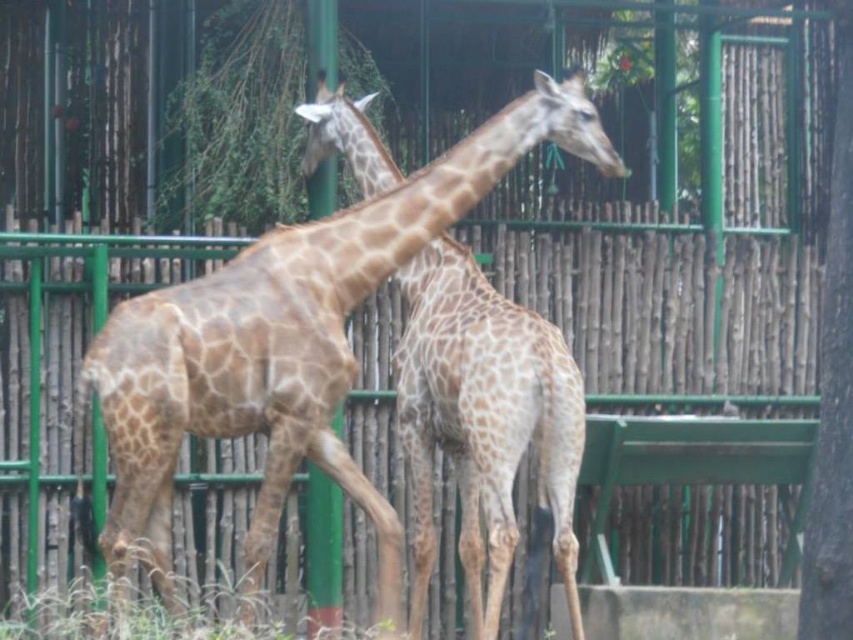
Question: Can you confirm if green bamboo fence at center is thinner than spotted fur giraffe at center?

Choices:
 (A) yes
 (B) no

Answer: (B)

Question: Considering the relative positions of green bamboo fence at center and spotted fur giraffe at center in the image provided, where is green bamboo fence at center located with respect to spotted fur giraffe at center?

Choices:
 (A) below
 (B) above

Answer: (B)

Question: Among these objects, which one is farthest from the camera?

Choices:
 (A) spotted fur giraffe at center
 (B) green bamboo fence at center

Answer: (B)

Question: Is green bamboo fence at center to the right of spotted fur giraffe at center from the viewer's perspective?

Choices:
 (A) no
 (B) yes

Answer: (B)